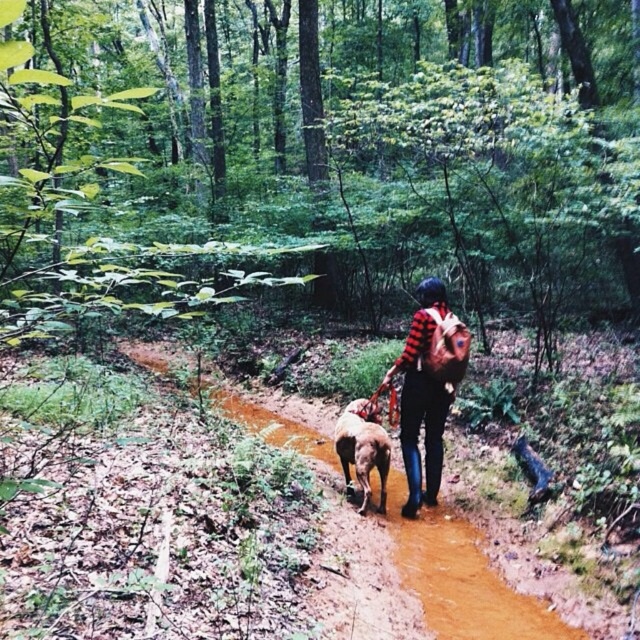
Does brown dirt trail at center appear over plaid shirt at center?

No.

The image size is (640, 640). Describe the element at coordinates (461, 579) in the screenshot. I see `brown dirt trail at center` at that location.

Is point (435, 592) positioned in front of point (442, 308)?

Yes, point (435, 592) is closer to viewer.

Find the location of a particular element. brown dirt trail at center is located at coordinates (461, 579).

Does brown dirt trail at center lie in front of brown furry dog at center?

Yes, brown dirt trail at center is in front of brown furry dog at center.

Based on the photo, which is above, brown dirt trail at center or brown furry dog at center?

Positioned higher is brown furry dog at center.

Which is in front, point (150, 369) or point (371, 460)?

Point (371, 460)

At what (x,y) coordinates should I click in order to perform the action: click on brown dirt trail at center. Please return your answer as a coordinate pair (x, y). Image resolution: width=640 pixels, height=640 pixels. Looking at the image, I should click on (461, 579).

Who is taller, plaid shirt at center or brown furry dog at center?

Standing taller between the two is plaid shirt at center.

Measure the distance from plaid shirt at center to brown furry dog at center.

The distance of plaid shirt at center from brown furry dog at center is 16.30 inches.

The width and height of the screenshot is (640, 640). Find the location of `plaid shirt at center`. plaid shirt at center is located at coordinates (426, 394).